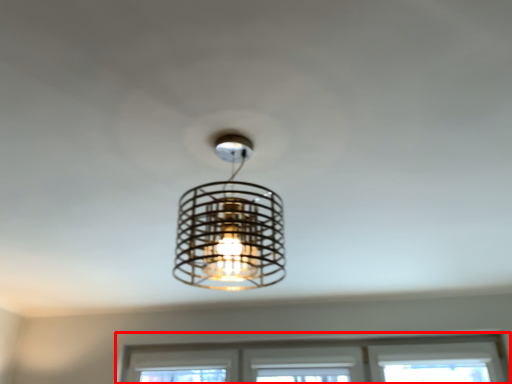
Question: From the image's perspective, considering the relative positions of window (annotated by the red box) and lamp in the image provided, where is window (annotated by the red box) located with respect to the staircase?

Choices:
 (A) below
 (B) above

Answer: (A)